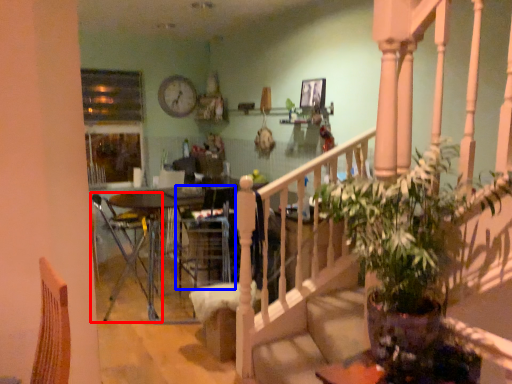
Question: Which point is closer to the camera, chair (highlighted by a red box) or armchair (highlighted by a blue box)?

Choices:
 (A) chair
 (B) armchair

Answer: (A)